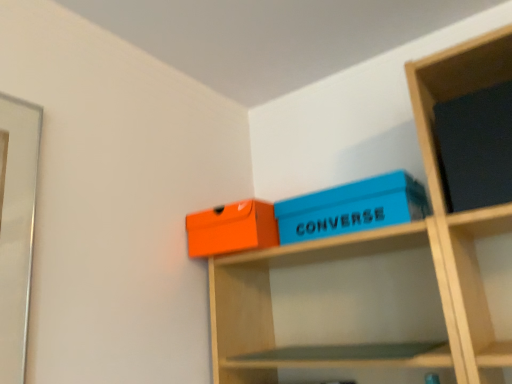
Question: From a real-world perspective, is matte orange box at upper center, the 1th box viewed from the left, located higher than matte black book at upper right?

Choices:
 (A) yes
 (B) no

Answer: (B)

Question: From the image's perspective, is matte orange box at upper center, the 1th box viewed from the left, located above matte black book at upper right?

Choices:
 (A) no
 (B) yes

Answer: (A)

Question: Is matte orange box at upper center, the 1th box viewed from the left, bigger than matte black book at upper right?

Choices:
 (A) no
 (B) yes

Answer: (A)

Question: Can matte black book at upper right be found inside matte orange box at upper center, arranged as the second box when viewed from the right?

Choices:
 (A) yes
 (B) no

Answer: (B)

Question: Is matte orange box at upper center, arranged as the second box when viewed from the right, thinner than matte black book at upper right?

Choices:
 (A) yes
 (B) no

Answer: (B)

Question: Considering the positions of matte orange box at upper center, the 1th box viewed from the left, and blue matte shoebox at upper center, which ranks as the first box in right-to-left order, in the image, is matte orange box at upper center, the 1th box viewed from the left, wider or thinner than blue matte shoebox at upper center, which ranks as the first box in right-to-left order,?

Choices:
 (A) wide
 (B) thin

Answer: (B)

Question: From the image's perspective, is matte orange box at upper center, arranged as the second box when viewed from the right, above or below blue matte shoebox at upper center, which is counted as the 2th box, starting from the left?

Choices:
 (A) below
 (B) above

Answer: (A)

Question: Is matte orange box at upper center, arranged as the second box when viewed from the right, taller or shorter than blue matte shoebox at upper center, which is counted as the 2th box, starting from the left?

Choices:
 (A) short
 (B) tall

Answer: (B)

Question: In the image, is matte orange box at upper center, arranged as the second box when viewed from the right, positioned in front of or behind blue matte shoebox at upper center, which is counted as the 2th box, starting from the left?

Choices:
 (A) front
 (B) behind

Answer: (B)

Question: Is matte black book at upper right in front of or behind matte orange box at upper center, arranged as the second box when viewed from the right, in the image?

Choices:
 (A) behind
 (B) front

Answer: (B)

Question: Would you say matte black book at upper right is inside or outside matte orange box at upper center, the 1th box viewed from the left?

Choices:
 (A) inside
 (B) outside

Answer: (B)

Question: Looking at their shapes, would you say matte black book at upper right is wider or thinner than matte orange box at upper center, the 1th box viewed from the left?

Choices:
 (A) thin
 (B) wide

Answer: (A)

Question: Is matte black book at upper right taller or shorter than matte orange box at upper center, the 1th box viewed from the left?

Choices:
 (A) tall
 (B) short

Answer: (A)

Question: From a real-world perspective, is blue matte shoebox at upper center, which ranks as the first box in right-to-left order, positioned above or below matte black book at upper right?

Choices:
 (A) below
 (B) above

Answer: (A)

Question: In terms of height, does blue matte shoebox at upper center, which is counted as the 2th box, starting from the left, look taller or shorter compared to matte black book at upper right?

Choices:
 (A) short
 (B) tall

Answer: (A)